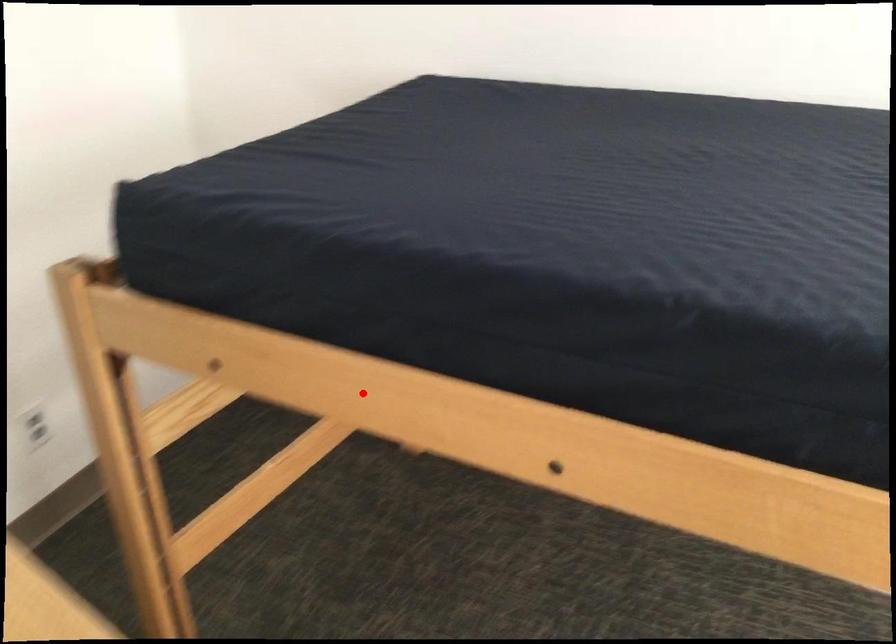
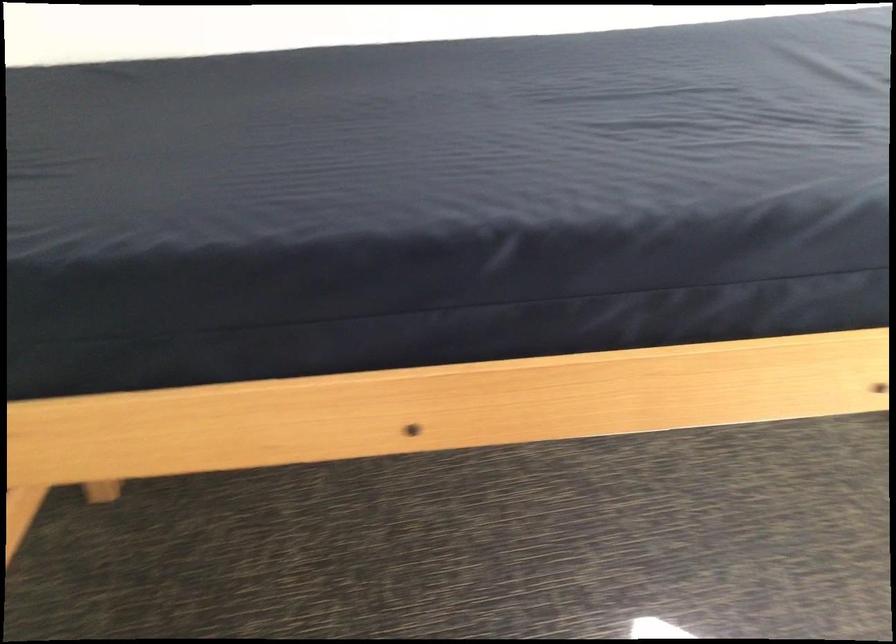
Question: I am providing you with two images of the same scene from different viewpoints. Given a red point in image1, look at the same physical point in image2. Is it:

Choices:
 (A) Closer to the viewpoint
 (B) Farther from the viewpoint

Answer: (A)